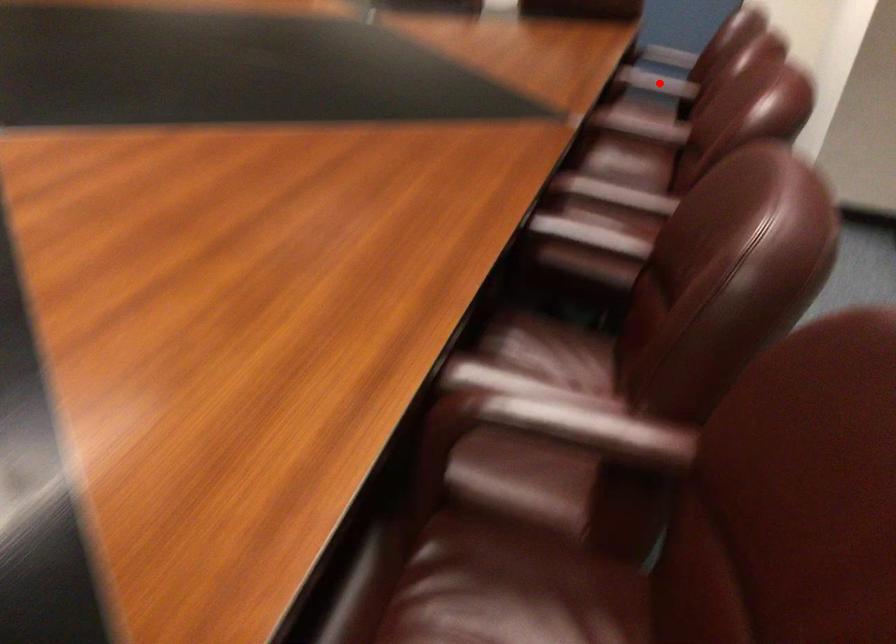
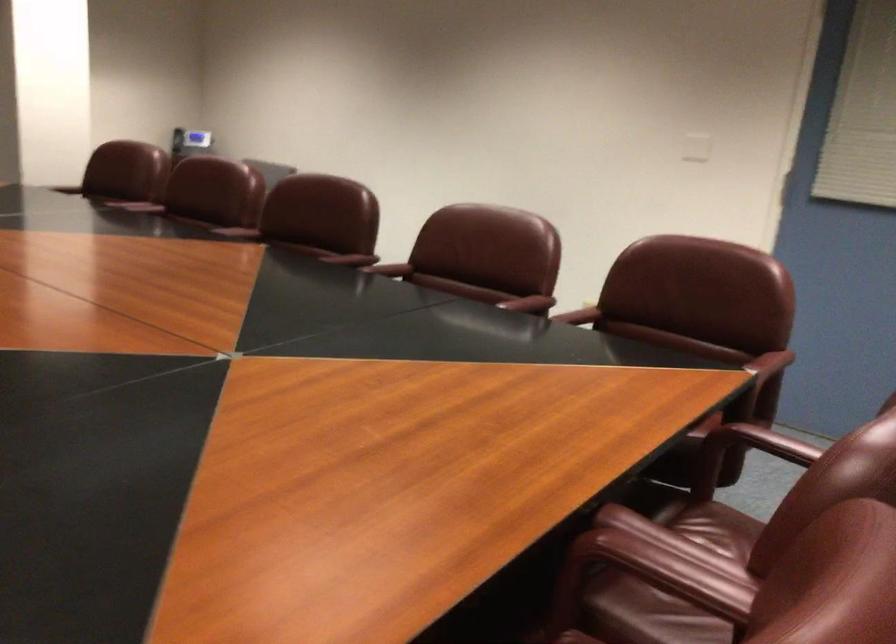
In the second image, find the point that corresponds to the highlighted location in the first image.

(657, 573)